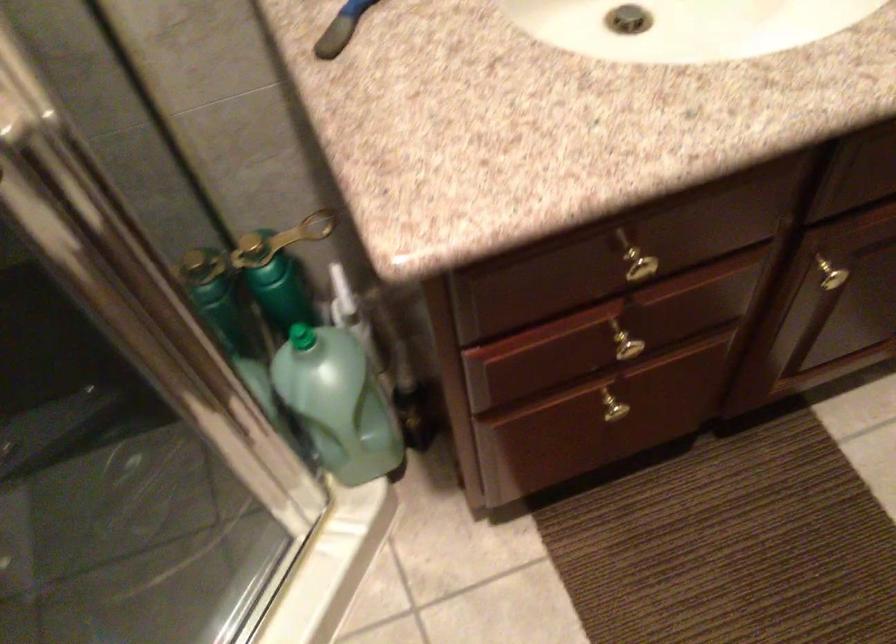
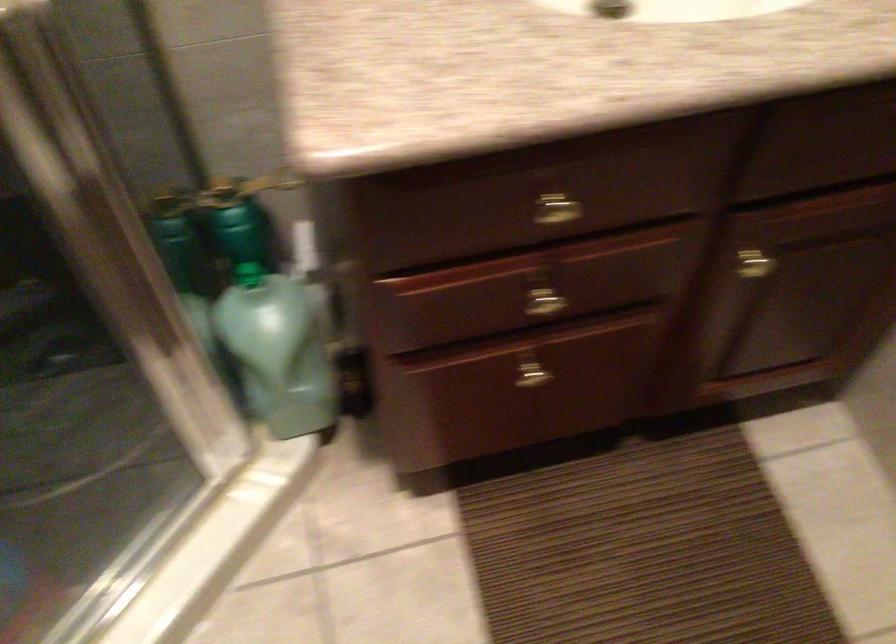
Question: What movement of the cameraman would produce the second image?

Choices:
 (A) Left
 (B) Right
 (C) Forward
 (D) Backward

Answer: (B)